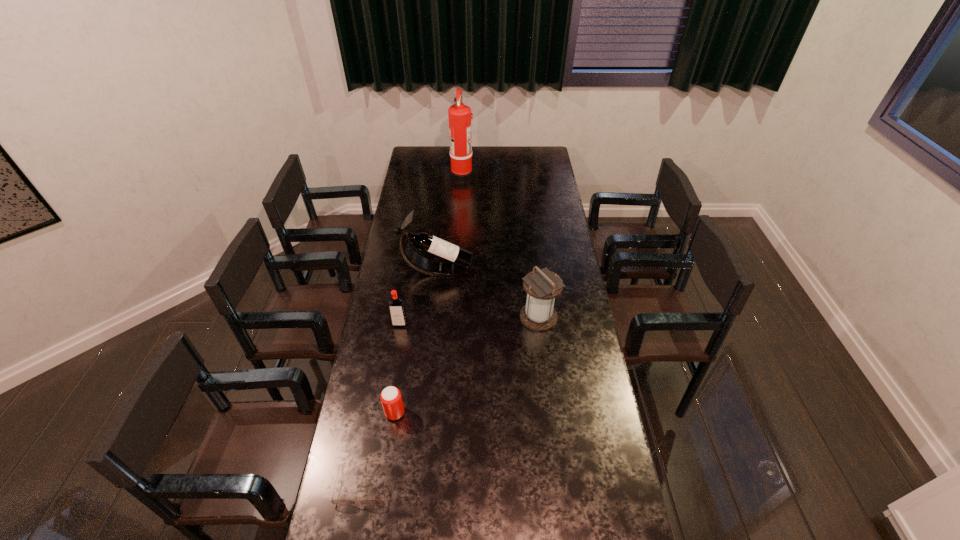
The width and height of the screenshot is (960, 540). I want to click on the tallest object, so click(x=461, y=171).

The width and height of the screenshot is (960, 540). In order to click on fire extinguisher in this screenshot , I will do `click(461, 171)`.

The width and height of the screenshot is (960, 540). I want to click on the second farthest object, so click(453, 255).

Locate an element on the screen. This screenshot has width=960, height=540. wine bottle is located at coordinates (453, 255).

This screenshot has height=540, width=960. What are the coordinates of `the rightmost object` in the screenshot? It's located at (542, 286).

You are a GUI agent. You are given a task and a screenshot of the screen. Output one action in this format:
    pyautogui.click(x=<x>, y=<y>)
    Task: Click on the lantern
    The height and width of the screenshot is (540, 960).
    Given the screenshot: What is the action you would take?
    pyautogui.click(x=542, y=286)

You are a GUI agent. You are given a task and a screenshot of the screen. Output one action in this format:
    pyautogui.click(x=<x>, y=<y>)
    Task: Click on the vodka
    The width and height of the screenshot is (960, 540).
    Given the screenshot: What is the action you would take?
    pyautogui.click(x=396, y=305)

Identify the location of the fifth tallest object. Image resolution: width=960 pixels, height=540 pixels. (391, 399).

Identify the location of beer can. The width and height of the screenshot is (960, 540). (391, 399).

Find the location of a particular element. The width and height of the screenshot is (960, 540). sunglasses is located at coordinates (339, 501).